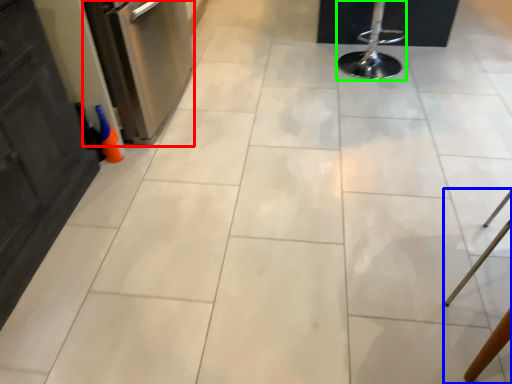
Question: Based on their relative distances, which object is nearer to dish washer (highlighted by a red box)? Choose from furniture (highlighted by a blue box) and bar stool (highlighted by a green box).

Choices:
 (A) furniture
 (B) bar stool

Answer: (B)